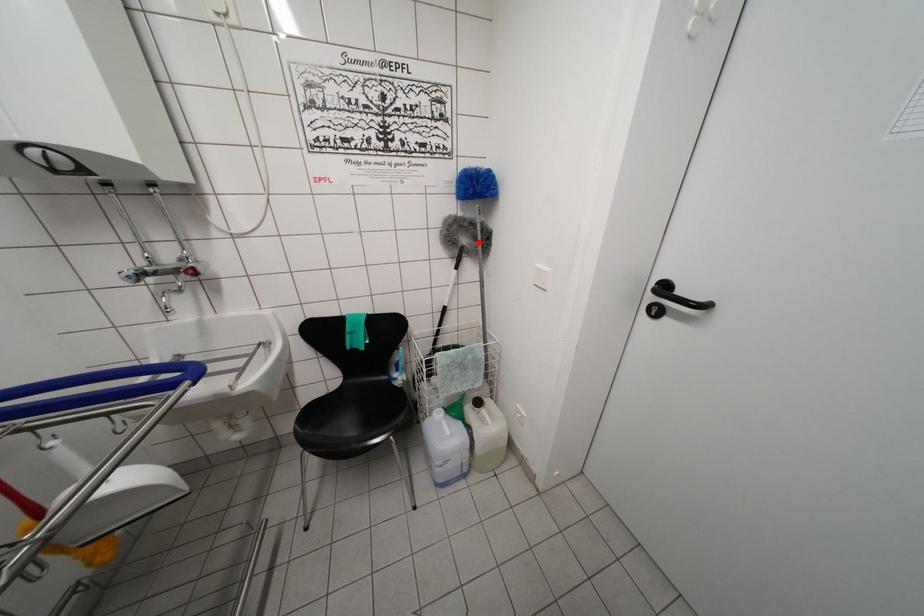
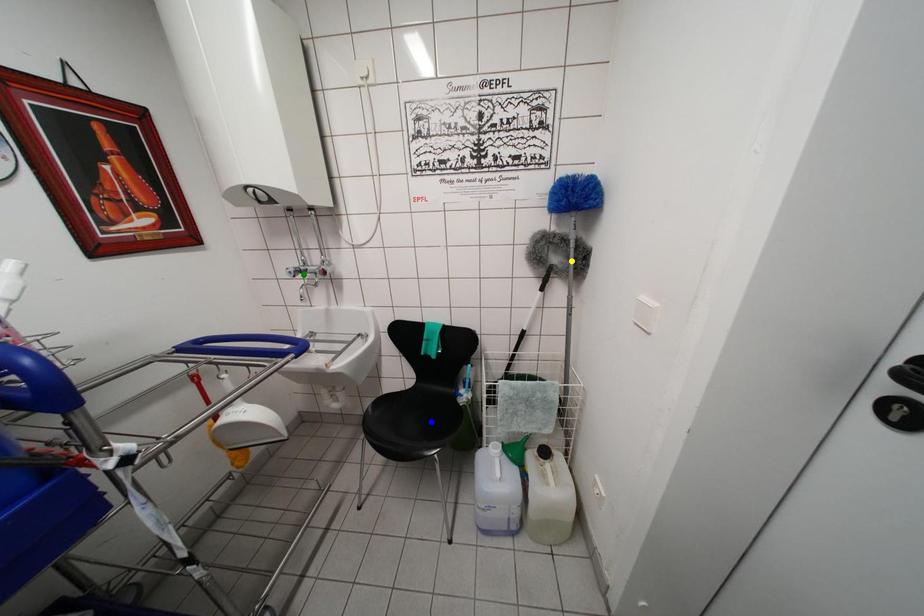
Question: I am providing you with two images of the same scene from different viewpoints. A red point is marked on the first image. You are given multiple points on the second image. Which point in image 2 is actually the same real-world point as the red point in image 1?

Choices:
 (A) blue point
 (B) green point
 (C) yellow point

Answer: (C)